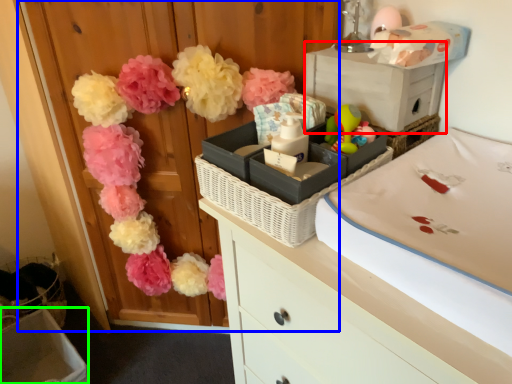
Question: Considering the real-world distances, which object is farthest from storage box (highlighted by a red box)? armoire (highlighted by a blue box) or storage box (highlighted by a green box)?

Choices:
 (A) armoire
 (B) storage box

Answer: (B)